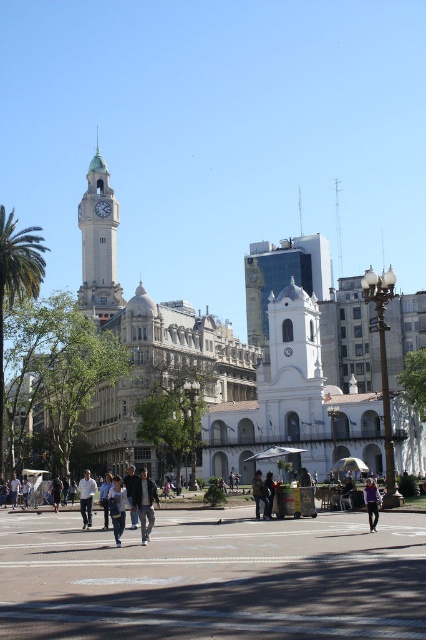
You are standing on the concrete pavement at center and want to walk towards the khaki fabric jacket at center. In which direction should you move?

You should move to the right because the concrete pavement at center is to the left of the khaki fabric jacket at center, so moving right will take you towards it.

You are standing in the middle of the bustling street in front of the historic building with the clock tower. You notice two points marked on the ground at coordinates point (273, 600) and point (262, 484). Which point is closer to you?

Point (273, 600) is closer to the viewer than point (262, 484).

You are standing at the corner of the street in the image and want to find the dark gray jacket at center. Which direction should you look to locate it?

The dark gray jacket at center is located at coordinates point 0.787 on the x axis and 0.340 on the y axis. Since the x coordinate is closer to 1, it means it is positioned more to the right side of the image. The y coordinate being 0.340 places it closer to the bottom half of the image. Therefore, you should look towards the lower right direction to find the dark gray jacket at center.